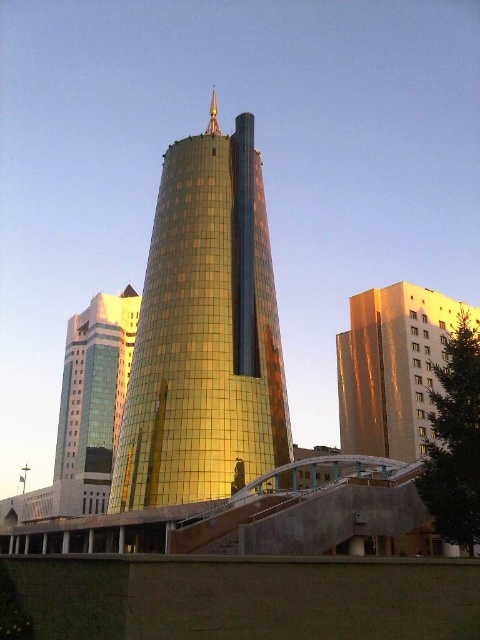
Question: Is gold reflective building at center to the right of matte glass skyscraper at left from the viewer's perspective?

Choices:
 (A) yes
 (B) no

Answer: (A)

Question: Is gold reflective building at center thinner than matte glass skyscraper at left?

Choices:
 (A) yes
 (B) no

Answer: (B)

Question: Which object appears closest to the camera in this image?

Choices:
 (A) matte glass skyscraper at left
 (B) gold reflective tower at center
 (C) gold reflective building at center

Answer: (B)

Question: Which point appears closest to the camera in this image?

Choices:
 (A) (157, 364)
 (B) (105, 324)
 (C) (422, 289)

Answer: (A)

Question: Estimate the real-world distances between objects in this image. Which object is farther from the matte glass skyscraper at left?

Choices:
 (A) gold reflective tower at center
 (B) gold reflective building at center

Answer: (B)

Question: Does gold reflective tower at center have a greater width compared to matte glass skyscraper at left?

Choices:
 (A) yes
 (B) no

Answer: (B)